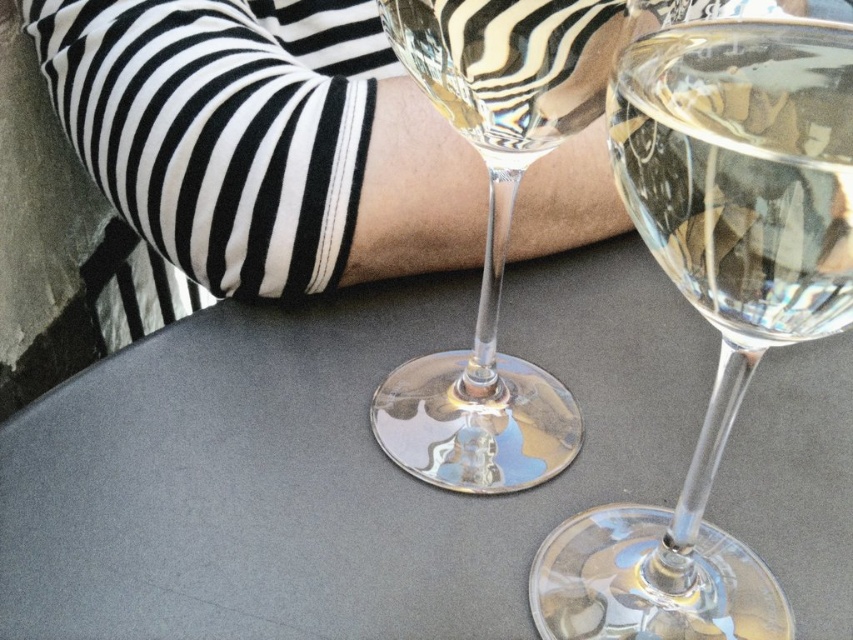
You are a photographer trying to capture the striped fabric arm at upper center in the image. The camera is positioned at the point marked by point (260, 140). Which direction should you move the camera to focus on the striped fabric arm at upper center?

The point (260, 140) already marks the striped fabric arm at upper center, so the camera is already positioned correctly to focus on it.

You are a server at an outdoor cafe and need to place a new drink order on the table. The drink is 10 cm tall. Can you fit it on the smooth gray table at center without it touching the striped fabric arm at upper center?

The smooth gray table at center is not as tall as striped fabric arm at upper center, meaning the table is shorter. Since the drink is 10 cm tall, placing it on the table wonot cause it to reach the striped fabric arm at upper center which is higher up.

You are a waiter at an outdoor cafe and need to place a small dessert plate between the two points on the table. The first point is point (129, 115) and the second is point (563, 611). Given that the dessert plate has a diameter of 20 cm, can you determine if there is enough space between them to place the plate without it overlapping either point?

Point (129, 115) is behind point (563, 611), so there is sufficient space between them to place the dessert plate without overlapping either point.